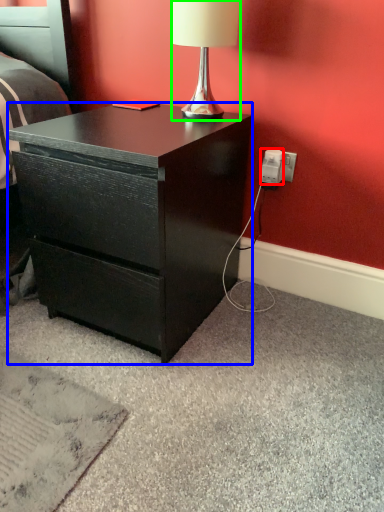
Question: Which is nearer to the power outlet (highlighted by a red box)? desk (highlighted by a blue box) or lamp (highlighted by a green box).

Choices:
 (A) desk
 (B) lamp

Answer: (B)